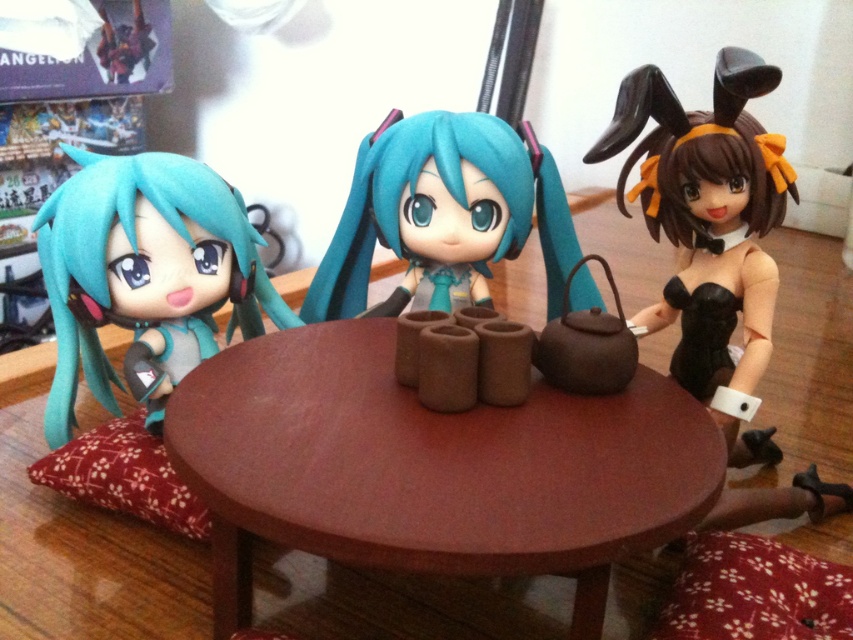
You are a guest at this tea ceremony scene. You need to sit on the red fabric pillow at lower left. However, you are concerned about the size of the pillow relative to the nearby figure with matte teal hair at left. Is the pillow big enough to accommodate you comfortably?

The matte teal hair at left is larger in size than the red fabric pillow at lower left. Since the pillow is smaller than the figure, it may not be big enough for you to sit comfortably.

In the miniature tea ceremony scene, you notice the matte teal hair at left and the red fabric pillow at lower left. From the perspective of someone sitting at the table, which object is positioned to the right of the other?

The matte teal hair at left is to the right of the red fabric pillow at lower left.

You are a small toy measuring 3 inches in width that wants to move from the red fabric pillow at lower left to the brown matte table at center. Can you fit through the space between them?

The distance between the red fabric pillow at lower left and the brown matte table at center is 10.65 inches, so the toy can easily move through since it is wider than the toy.